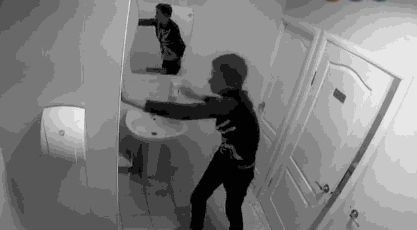
You are a GUI agent. You are given a task and a screenshot of the screen. Output one action in this format:
    pyautogui.click(x=<x>, y=<y>)
    Task: Click on the tile floor
    
    Given the screenshot: What is the action you would take?
    pyautogui.click(x=237, y=191)